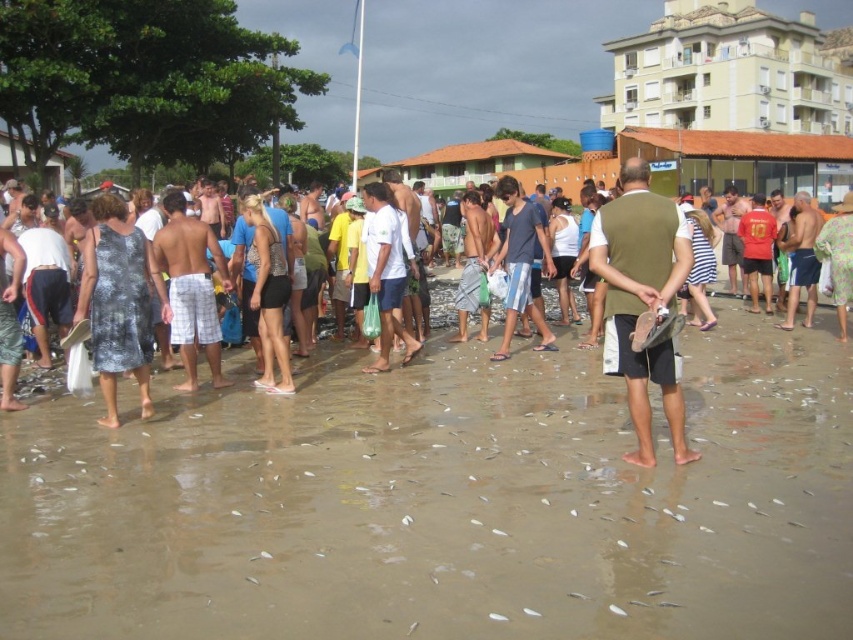
You are a photographer at the beach and want to capture a photo that includes both the printed fabric dress at left and the blue cotton shirt at center. Based on their positions, which object should be placed on the left side of the photo frame?

The printed fabric dress at left should be placed on the left side of the photo frame since it is positioned to the left of the blue cotton shirt at center.

You are standing at the beach and want to reach the point marked as point (x=384, y=356). There is an obstacle at point (x=155, y=262). Will you have to go around the obstacle to reach your destination?

Point (x=155, y=262) is in front of point (x=384, y=356), so you will have to go around the obstacle at point (x=155, y=262) to reach your destination.